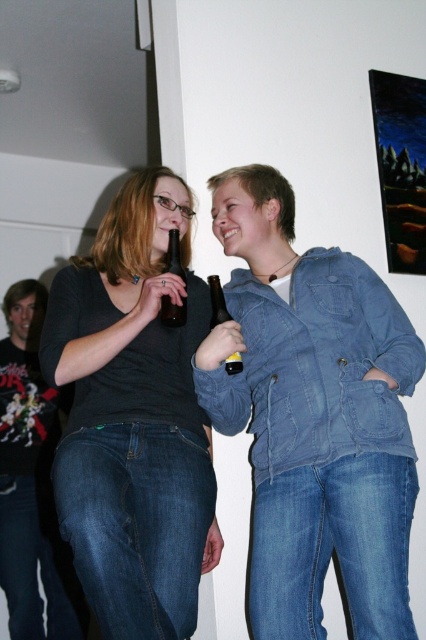
Question: Which point is farther to the camera?

Choices:
 (A) (227, 372)
 (B) (166, 536)
 (C) (11, 310)
 (D) (175, 320)

Answer: (C)

Question: Is matte black shirt at center to the left of dark gray sweater at left from the viewer's perspective?

Choices:
 (A) no
 (B) yes

Answer: (A)

Question: Which point is farther to the camera?

Choices:
 (A) (282, 513)
 (B) (71, 570)
 (C) (213, 308)
 (D) (127, 365)

Answer: (B)

Question: From the image, what is the correct spatial relationship of dark gray sweater at left in relation to brown glass bottle at center?

Choices:
 (A) above
 (B) below

Answer: (B)

Question: Which of the following is the closest to the observer?

Choices:
 (A) (374, 628)
 (B) (65, 577)
 (C) (169, 317)
 (D) (192, 632)

Answer: (A)

Question: Is matte black shirt at center closer to the viewer compared to matte glass bottle at center?

Choices:
 (A) no
 (B) yes

Answer: (B)